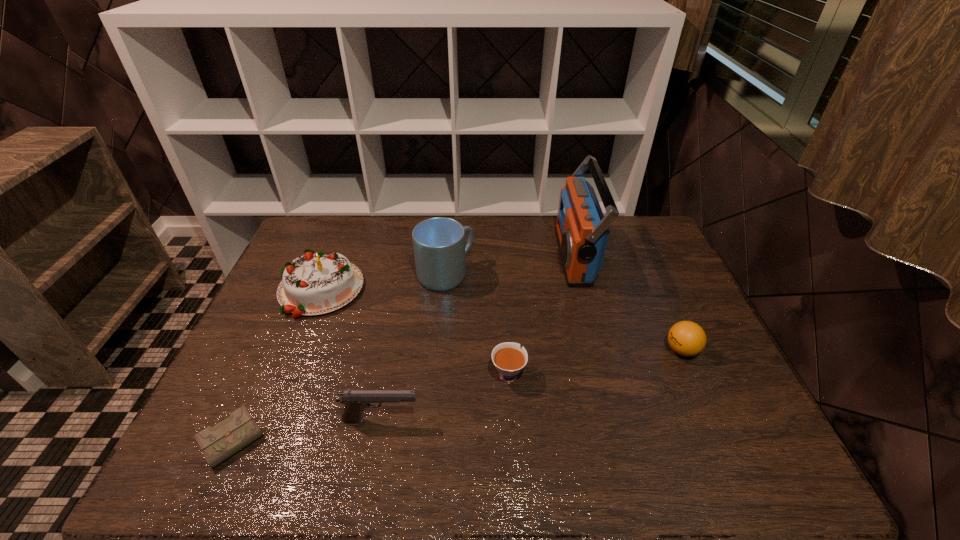
The height and width of the screenshot is (540, 960). I want to click on vacant space located on the front-facing side of the tallest object, so click(542, 256).

Identify the location of vacant space located 0.390m on the front-facing side of the tallest object. This screenshot has height=540, width=960. click(442, 256).

The height and width of the screenshot is (540, 960). I want to click on free space located 0.140m on the front-facing side of the tallest object, so click(516, 256).

This screenshot has height=540, width=960. Identify the location of vacant space positioned 0.180m on the back of the mug. [x=450, y=228].

Locate an element on the screen. The image size is (960, 540). blank area located 0.210m on the back of the fifth shortest object is located at coordinates (346, 226).

Where is `free space located at the barrel of the pistol`? The width and height of the screenshot is (960, 540). free space located at the barrel of the pistol is located at coordinates click(510, 420).

This screenshot has width=960, height=540. Find the location of `free space located 0.220m on the side with brand of the rightmost object`. free space located 0.220m on the side with brand of the rightmost object is located at coordinates (583, 350).

Identify the location of free space located 0.300m on the side with brand of the rightmost object. The image size is (960, 540). (553, 350).

At what (x,y) coordinates should I click in order to perform the action: click on free space located 0.380m on the side with brand of the rightmost object. Please return your answer as a coordinate pair (x, y). Looking at the image, I should click on (523, 350).

The height and width of the screenshot is (540, 960). Identify the location of vacant area situated 0.050m on the side of the sixth tallest object with the handle. (507, 343).